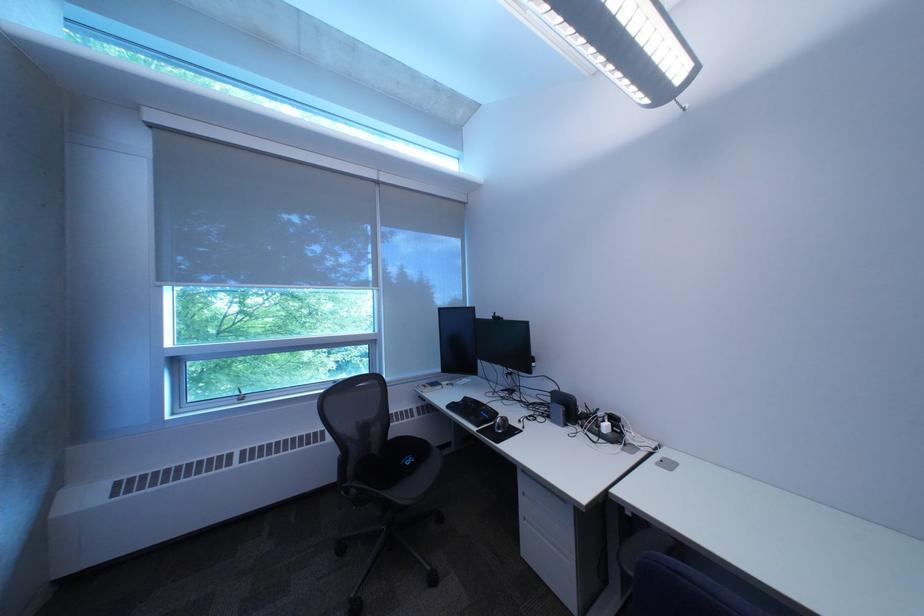
Where would you pull the light pull chain? Please return your answer as a coordinate pair (x, y).

(679, 105)